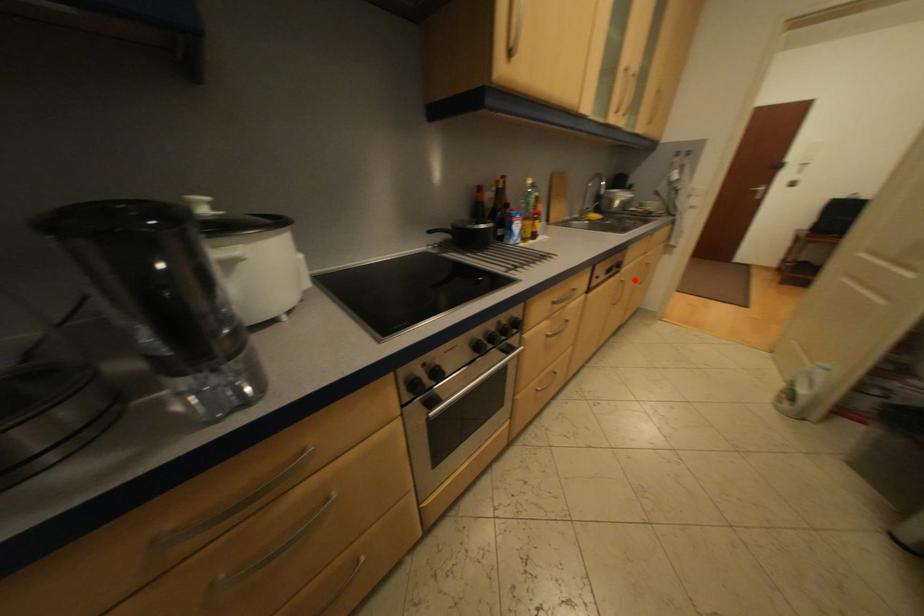
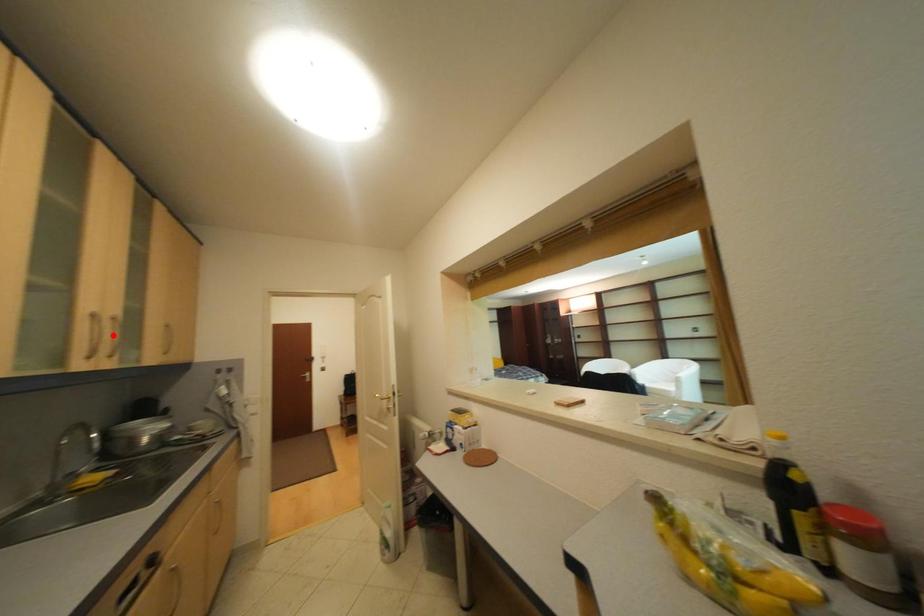
I am providing you with two images of the same scene from different viewpoints. A red point is marked on the first image and another point is marked on the second image. Is the marked point in image1 the same physical position as the marked point in image2?

No